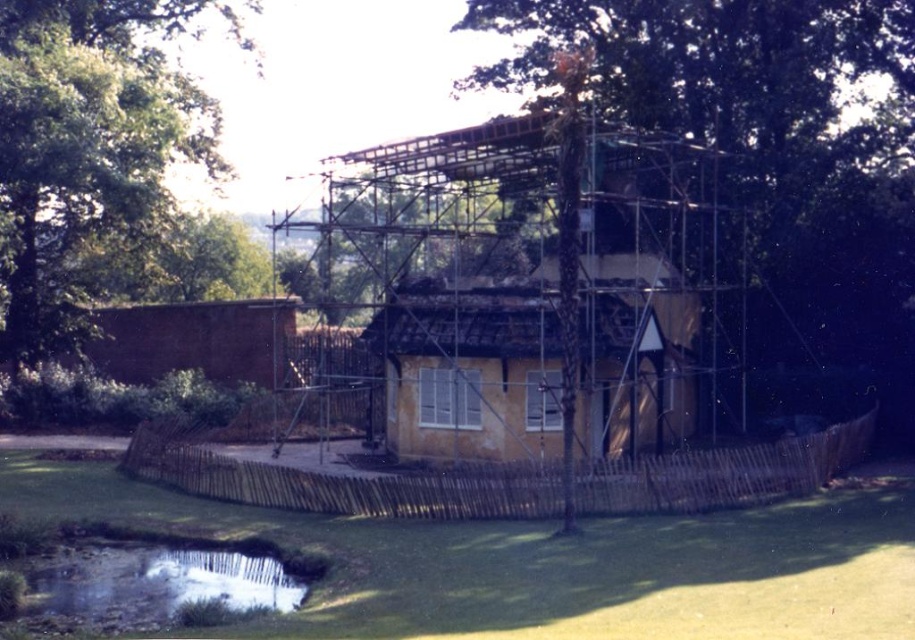
Is green leafy tree at upper left to the left of yellow wood house at center from the viewer's perspective?

Yes, green leafy tree at upper left is to the left of yellow wood house at center.

Who is more distant from viewer, (59, 88) or (591, 435)?

Point (59, 88)

Where is `green leafy tree at upper left`? Image resolution: width=915 pixels, height=640 pixels. green leafy tree at upper left is located at coordinates (89, 145).

Locate an element on the screen. The width and height of the screenshot is (915, 640). green leafy tree at upper left is located at coordinates (89, 145).

Between green leafy tree at center and green leafy tree at upper left, which one is positioned higher?

green leafy tree at upper left is higher up.

Is point (910, 280) farther from viewer compared to point (15, 269)?

No, it is in front of (15, 269).

What do you see at coordinates (768, 148) in the screenshot?
I see `green leafy tree at center` at bounding box center [768, 148].

Identify the location of green leafy tree at center. (768, 148).

Based on the photo, is yellow wood house at center shorter than reflective gravel creek at lower left?

Incorrect, yellow wood house at center's height does not fall short of reflective gravel creek at lower left's.

Who is lower down, yellow wood house at center or reflective gravel creek at lower left?

reflective gravel creek at lower left is below.

Is point (650, 385) positioned in front of point (196, 561)?

No, (650, 385) is further to viewer.

This screenshot has height=640, width=915. In order to click on yellow wood house at center in this screenshot , I will do `click(471, 368)`.